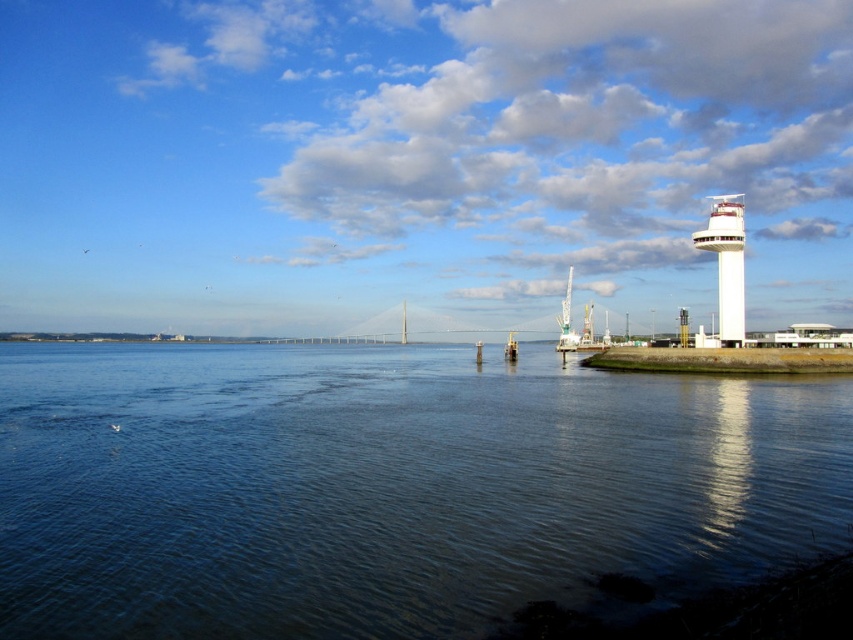
Question: Can you confirm if white smooth tower at right is smaller than white metallic crane at center-right?

Choices:
 (A) yes
 (B) no

Answer: (A)

Question: Which point is closer to the camera taking this photo?

Choices:
 (A) (590, 307)
 (B) (820, 445)

Answer: (B)

Question: Can you confirm if dark blue water at center is smaller than white smooth tower at right?

Choices:
 (A) yes
 (B) no

Answer: (B)

Question: Can you confirm if white smooth tower at right is smaller than white metallic crane at center-right?

Choices:
 (A) no
 (B) yes

Answer: (B)

Question: Considering the real-world distances, which object is farthest from the white metallic crane at center-right?

Choices:
 (A) white smooth tower at right
 (B) dark blue water at center

Answer: (A)

Question: Which point is farther to the camera?

Choices:
 (A) white smooth tower at right
 (B) white metallic crane at center-right
 (C) dark blue water at center

Answer: (B)